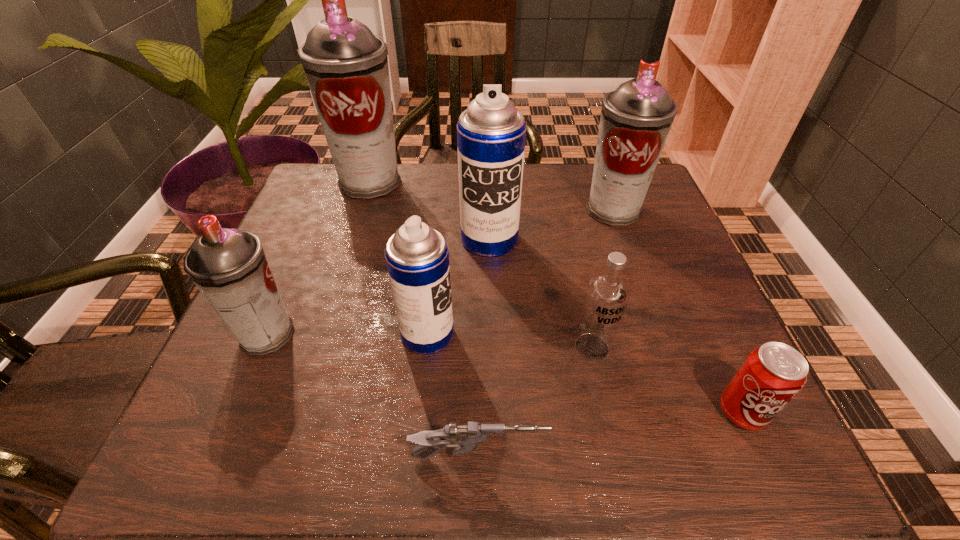
Locate an element on the screen. The height and width of the screenshot is (540, 960). vacant point located between the seventh tallest object and the tallest aerosol can is located at coordinates (556, 297).

Locate an element on the screen. This screenshot has height=540, width=960. empty space between the biggest gray aerosol can and the right blue aerosol can is located at coordinates (429, 211).

Identify which object is located as the sixth nearest to the seventh farthest object. Please provide its 2D coordinates. Your answer should be formatted as a tuple, i.e. [(x, y)], where the tuple contains the x and y coordinates of a point satisfying the conditions above.

[(229, 266)]

Identify the location of object that is the sixth closest to the vodka. Image resolution: width=960 pixels, height=540 pixels. (229, 266).

The width and height of the screenshot is (960, 540). What are the coordinates of `the fifth closest aerosol can to the shortest object` in the screenshot? It's located at (346, 66).

Select which aerosol can appears as the second closest to the rightmost aerosol can. Please provide its 2D coordinates. Your answer should be formatted as a tuple, i.e. [(x, y)], where the tuple contains the x and y coordinates of a point satisfying the conditions above.

[(417, 257)]

In order to click on the closest gray aerosol can to the shortest object in this screenshot , I will do `click(229, 266)`.

The height and width of the screenshot is (540, 960). I want to click on gray aerosol can that is the third closest to the soda, so click(346, 66).

This screenshot has width=960, height=540. I want to click on blank area in the image that satisfies the following two spatial constraints: 1. on the label side of the fourth aerosol can from left to right; 2. on the label side of the nearer blue aerosol can, so click(492, 334).

Where is `vacant region that satisfies the following two spatial constraints: 1. on the back side of the soda; 2. on the label side of the third aerosol can from left to right`? This screenshot has height=540, width=960. vacant region that satisfies the following two spatial constraints: 1. on the back side of the soda; 2. on the label side of the third aerosol can from left to right is located at coordinates (707, 334).